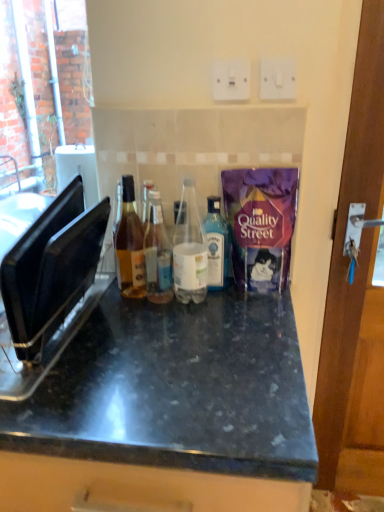
The height and width of the screenshot is (512, 384). I want to click on vacant space that's between translucent glass bottle at center, which is counted as the 3th bottle, starting from the right, and black plastic toaster at left, so click(127, 324).